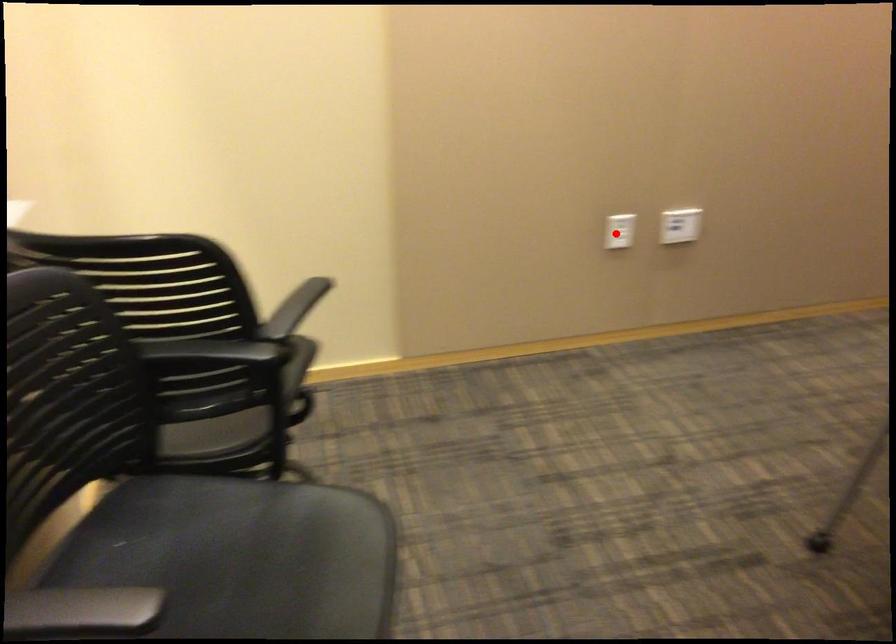
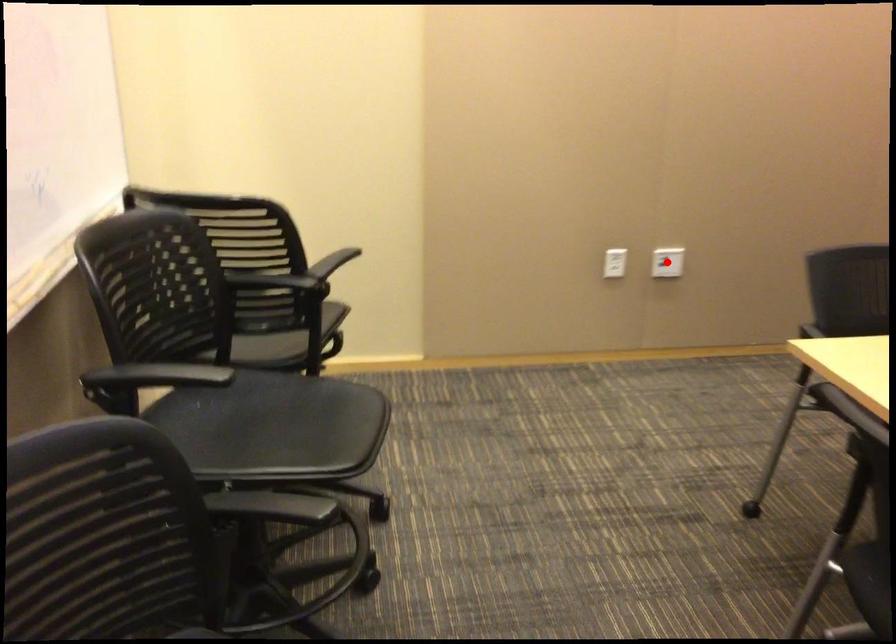
I am providing you with two images of the same scene from different viewpoints. A red point is marked on the first image and another point is marked on the second image. Do the highlighted points in image1 and image2 indicate the same real-world spot?

No